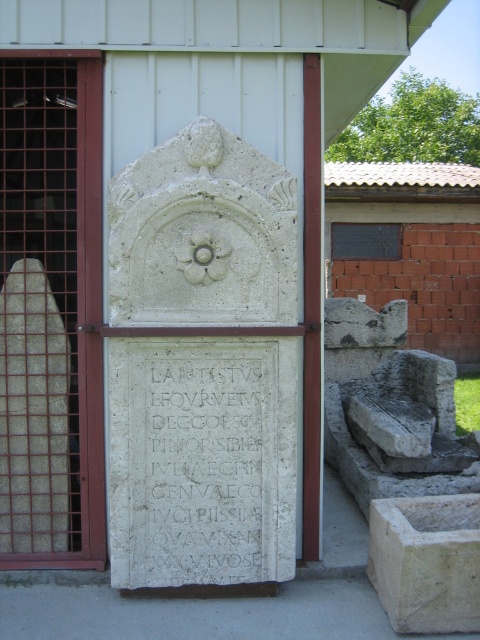
Question: Does white stone plaque at center appear under white stone inscription at center?

Choices:
 (A) no
 (B) yes

Answer: (A)

Question: Does white stone plaque at center appear over white stone inscription at center?

Choices:
 (A) yes
 (B) no

Answer: (A)

Question: Which point is farther to the camera?

Choices:
 (A) (139, 355)
 (B) (249, 502)
 (C) (453, 570)

Answer: (B)

Question: Which object is the closest to the white stone basin at lower right?

Choices:
 (A) white stone plaque at center
 (B) white stone inscription at center

Answer: (B)

Question: Can you confirm if white stone inscription at center is positioned below white stone basin at lower right?

Choices:
 (A) yes
 (B) no

Answer: (B)

Question: Among these objects, which one is nearest to the camera?

Choices:
 (A) white stone basin at lower right
 (B) white stone inscription at center

Answer: (A)